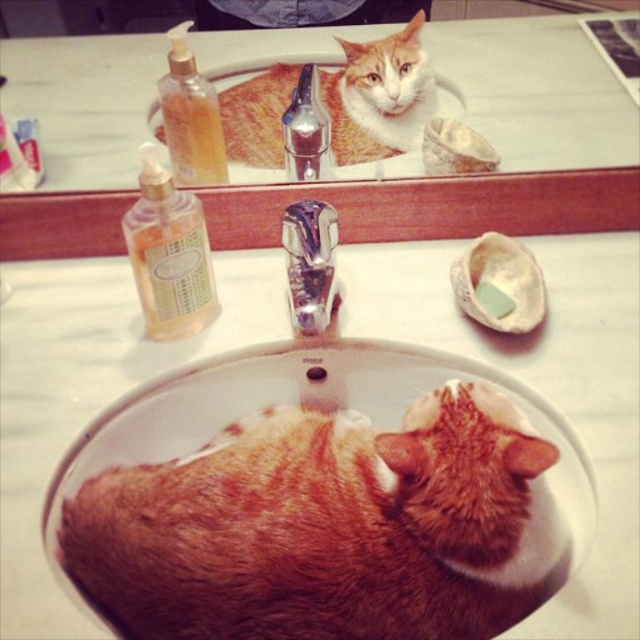
Question: Considering the relative positions of translucent glass soap dispenser at left and transparent plastic soap dispenser at center in the image provided, where is translucent glass soap dispenser at left located with respect to transparent plastic soap dispenser at center?

Choices:
 (A) left
 (B) right

Answer: (A)

Question: Does translucent glass soap dispenser at left come behind transparent plastic soap dispenser at center?

Choices:
 (A) yes
 (B) no

Answer: (B)

Question: Which point is closer to the camera?

Choices:
 (A) (433, 486)
 (B) (317, 138)
 (C) (177, 116)
 (D) (172, 316)

Answer: (A)

Question: Does translucent glass soap dispenser at left appear over silver metallic faucet at center?

Choices:
 (A) yes
 (B) no

Answer: (A)

Question: Among these objects, which one is nearest to the camera?

Choices:
 (A) orange fur tabby cat at upper center
 (B) translucent glass soap dispenser at upper left
 (C) transparent plastic soap dispenser at center
 (D) translucent glass soap dispenser at left

Answer: (D)

Question: Which of these objects is positioned farthest from the orange fur tabby cat at upper center?

Choices:
 (A) white matte soap at sink center
 (B) orange fur cat at center

Answer: (B)